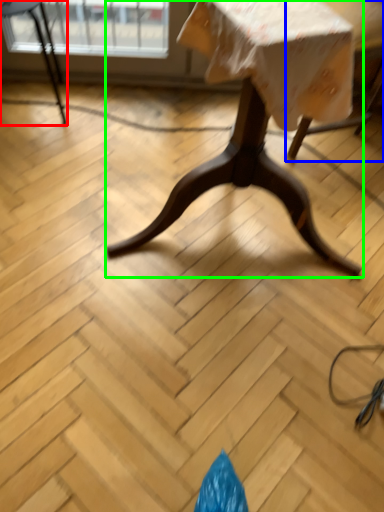
Question: Considering the real-world distances, which object is closest to chair (highlighted by a red box)? swivel chair (highlighted by a blue box) or table (highlighted by a green box).

Choices:
 (A) swivel chair
 (B) table

Answer: (A)